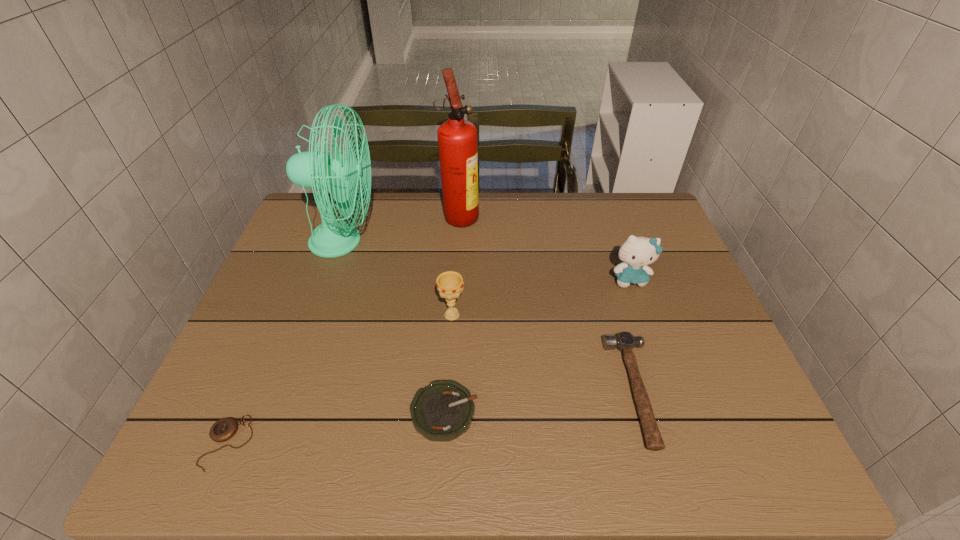
This screenshot has height=540, width=960. Find the location of `blank space located 0.060m on the face of the fifth shortest object`. blank space located 0.060m on the face of the fifth shortest object is located at coordinates (640, 307).

Where is `free space located 0.080m on the right of the fourth nearest object`? The height and width of the screenshot is (540, 960). free space located 0.080m on the right of the fourth nearest object is located at coordinates (496, 315).

Image resolution: width=960 pixels, height=540 pixels. Identify the location of vacant space located 0.270m on the striking face of the hammer. (490, 390).

In order to click on free point located on the striking face of the hammer in this screenshot , I will do `click(444, 390)`.

Find the location of `vacant space located 0.200m on the striking face of the hammer`. vacant space located 0.200m on the striking face of the hammer is located at coordinates (522, 390).

Where is `free location located on the left of the ashtray`? This screenshot has height=540, width=960. free location located on the left of the ashtray is located at coordinates (292, 412).

At what (x,y) coordinates should I click in order to perform the action: click on free space located on the right of the shortest object. Please return your answer as a coordinate pair (x, y). Image resolution: width=960 pixels, height=540 pixels. Looking at the image, I should click on (450, 443).

Locate an element on the screen. This screenshot has width=960, height=540. fire extinguisher present at the far edge is located at coordinates (457, 138).

The height and width of the screenshot is (540, 960). Find the location of `fan at the far edge`. fan at the far edge is located at coordinates (314, 169).

What are the coordinates of `hammer located in the near edge section of the desktop` in the screenshot? It's located at (624, 341).